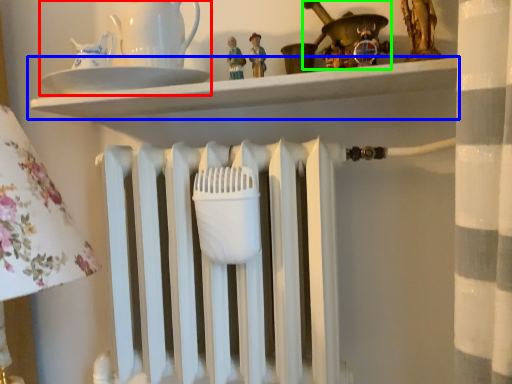
Question: Estimate the real-world distances between objects in this image. Which object is closer to tea set (highlighted by a red box), shelf (highlighted by a blue box) or toy (highlighted by a green box)?

Choices:
 (A) shelf
 (B) toy

Answer: (A)